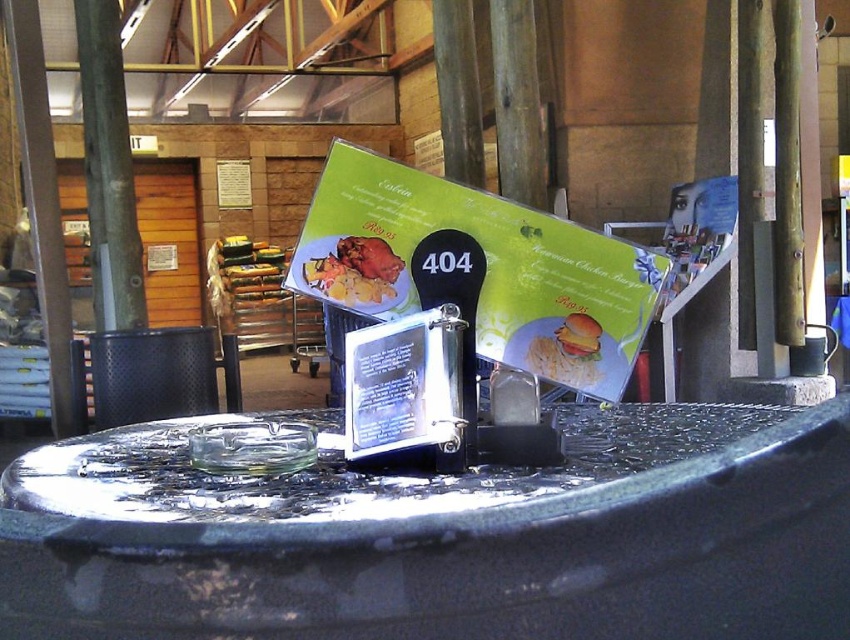
You are a customer at this table and want to grab the golden crispy hamburger at center without touching the metallic pole at center. Is this possible?

The metallic pole at center is further to the viewer than golden crispy hamburger at center, so you can reach the golden crispy hamburger at center without touching the metallic pole at center.

Based on the photo, you are a customer at this table and want to place your phone on either the metallic pole at center or the matte brown crab at center. Which object can you choose to ensure your phone won

The metallic pole at center has a greater height compared to matte brown crab at center. Therefore, placing the phone on the metallic pole at center will provide a higher surface, making it easier to view.